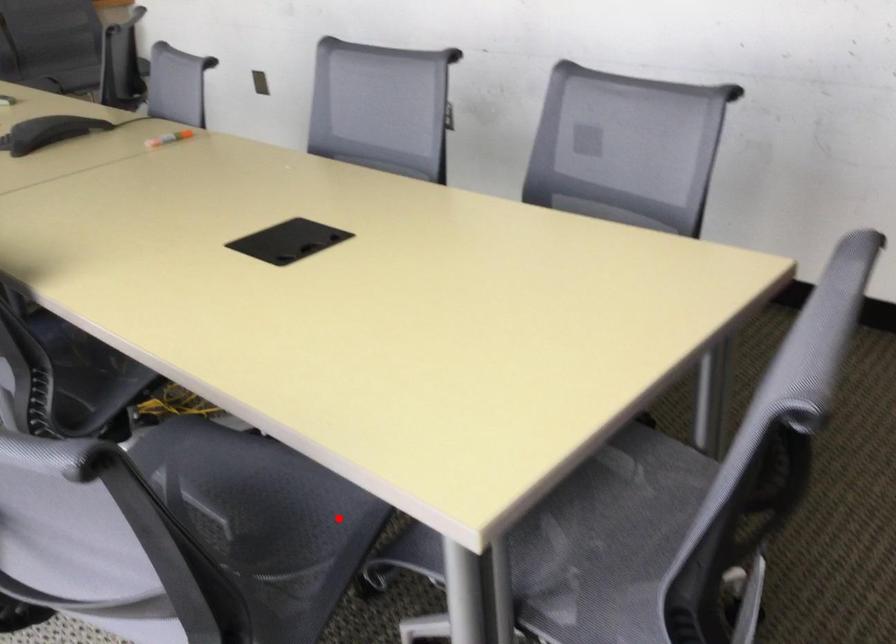
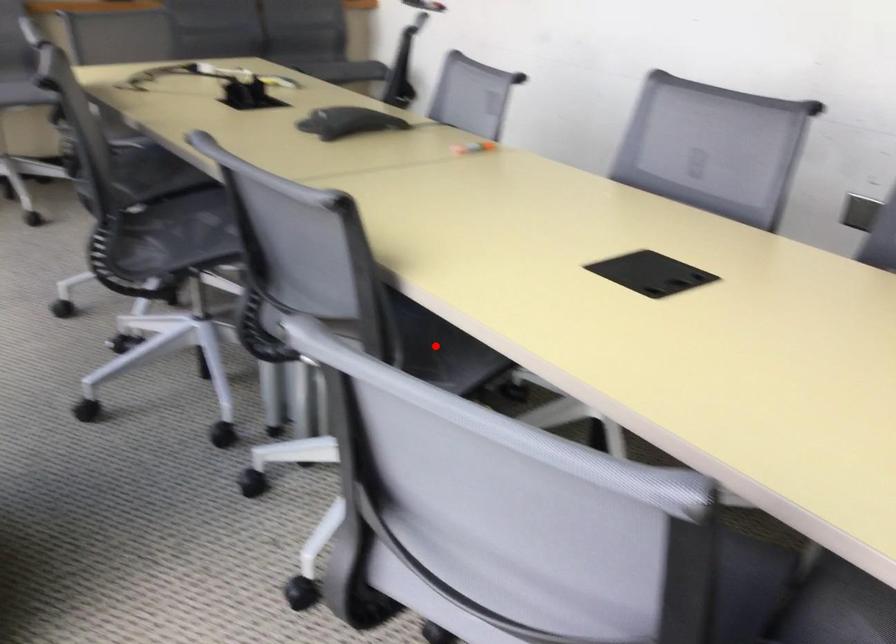
I am providing you with two images of the same scene from different viewpoints. A red point is marked on the first image and another point is marked on the second image. Do the highlighted points in image1 and image2 indicate the same real-world spot?

No